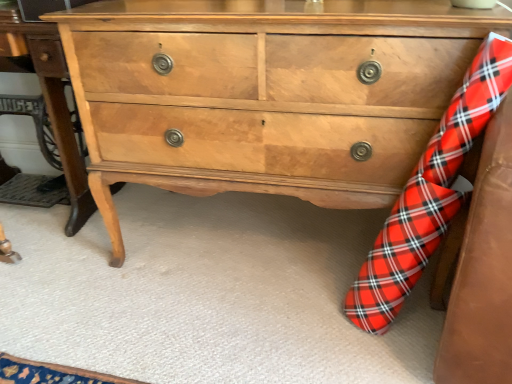
Measure the distance between point (x=113, y=188) and camera.

A distance of 1.71 meters exists between point (x=113, y=188) and camera.

You are a GUI agent. You are given a task and a screenshot of the screen. Output one action in this format:
    pyautogui.click(x=<x>, y=<y>)
    Task: Click on the red plaid sock at lower right
    
    Given the screenshot: What is the action you would take?
    pyautogui.click(x=429, y=194)

Is red plaid sock at lower right surrounded by light brown wood table at center?

No, light brown wood table at center does not contain red plaid sock at lower right.

Considering the relative sizes of light brown wood table at center and red plaid sock at lower right in the image provided, is light brown wood table at center wider than red plaid sock at lower right?

Yes, light brown wood table at center is wider than red plaid sock at lower right.

From the picture: Is light brown wood table at center far away from red plaid sock at lower right?

That's right, there is a large distance between light brown wood table at center and red plaid sock at lower right.

From the image's perspective, between light brown wood table at center and red plaid sock at lower right, who is located below?

red plaid sock at lower right appears lower in the image.

Is red plaid sock at lower right facing towards light brown wood table at center?

No, red plaid sock at lower right is not aimed at light brown wood table at center.

Which object is further away from the camera taking this photo, red plaid sock at lower right or light brown wood table at center?

Positioned behind is light brown wood table at center.

Considering the positions of points (404, 210) and (67, 69), is point (404, 210) farther from camera compared to point (67, 69)?

No.

Considering the sizes of objects red plaid sock at lower right and light brown wood table at center in the image provided, who is thinner, red plaid sock at lower right or light brown wood table at center?

With smaller width is red plaid sock at lower right.

Considering the relative sizes of light brown wood chest of drawers at center and light brown wood table at center in the image provided, is light brown wood chest of drawers at center wider than light brown wood table at center?

Correct, the width of light brown wood chest of drawers at center exceeds that of light brown wood table at center.

Who is shorter, light brown wood chest of drawers at center or light brown wood table at center?

light brown wood table at center is shorter.

Considering the positions of objects light brown wood chest of drawers at center and light brown wood table at center in the image provided, who is behind, light brown wood chest of drawers at center or light brown wood table at center?

light brown wood table at center.

This screenshot has width=512, height=384. I want to click on chest of drawers in front of the light brown wood table at center, so click(x=265, y=94).

Which point is more distant from viewer, (x=71, y=158) or (x=410, y=111)?

The point (x=71, y=158) is more distant.

Where is `the chest of drawers located in front of the light brown wood table at center`? The image size is (512, 384). the chest of drawers located in front of the light brown wood table at center is located at coordinates (265, 94).

Is light brown wood table at center facing away from light brown wood chest of drawers at center?

light brown wood table at center does not have its back to light brown wood chest of drawers at center.

From a real-world perspective, is light brown wood chest of drawers at center positioned above or below red plaid sock at lower right?

From a real-world perspective, light brown wood chest of drawers at center is physically above red plaid sock at lower right.

Is red plaid sock at lower right at the back of light brown wood chest of drawers at center?

No, light brown wood chest of drawers at center's orientation is not away from red plaid sock at lower right.

Considering the positions of objects light brown wood chest of drawers at center and red plaid sock at lower right in the image provided, who is in front, light brown wood chest of drawers at center or red plaid sock at lower right?

red plaid sock at lower right.

Does red plaid sock at lower right turn towards light brown wood chest of drawers at center?

No, red plaid sock at lower right is not oriented towards light brown wood chest of drawers at center.

The height and width of the screenshot is (384, 512). Identify the location of the chest of drawers above the red plaid sock at lower right (from a real-world perspective). (265, 94).

Does red plaid sock at lower right have a larger size compared to light brown wood chest of drawers at center?

No.

From the image's perspective, is red plaid sock at lower right on top of light brown wood chest of drawers at center?

Actually, red plaid sock at lower right appears below light brown wood chest of drawers at center in the image.

What are the coordinates of `table behind the red plaid sock at lower right` in the screenshot? It's located at (57, 110).

This screenshot has height=384, width=512. In order to click on table on the left of red plaid sock at lower right in this screenshot , I will do `click(57, 110)`.

When comparing their distances from light brown wood table at center, does light brown wood chest of drawers at center or red plaid sock at lower right seem closer?

light brown wood chest of drawers at center.

Considering their positions, is light brown wood table at center positioned closer to light brown wood chest of drawers at center than red plaid sock at lower right?

red plaid sock at lower right is positioned closer to the anchor light brown wood chest of drawers at center.

Considering their positions, is light brown wood table at center positioned closer to red plaid sock at lower right than light brown wood chest of drawers at center?

light brown wood chest of drawers at center lies closer to red plaid sock at lower right than the other object.

Considering their positions, is light brown wood chest of drawers at center positioned further to red plaid sock at lower right than light brown wood table at center?

light brown wood table at center.

Considering their positions, is red plaid sock at lower right positioned closer to light brown wood table at center than light brown wood chest of drawers at center?

light brown wood chest of drawers at center lies closer to light brown wood table at center than the other object.

When comparing their distances from light brown wood chest of drawers at center, does red plaid sock at lower right or light brown wood table at center seem closer?

red plaid sock at lower right lies closer to light brown wood chest of drawers at center than the other object.

Where is `the chest of drawers situated between light brown wood table at center and red plaid sock at lower right from left to right`? Image resolution: width=512 pixels, height=384 pixels. the chest of drawers situated between light brown wood table at center and red plaid sock at lower right from left to right is located at coordinates 265,94.